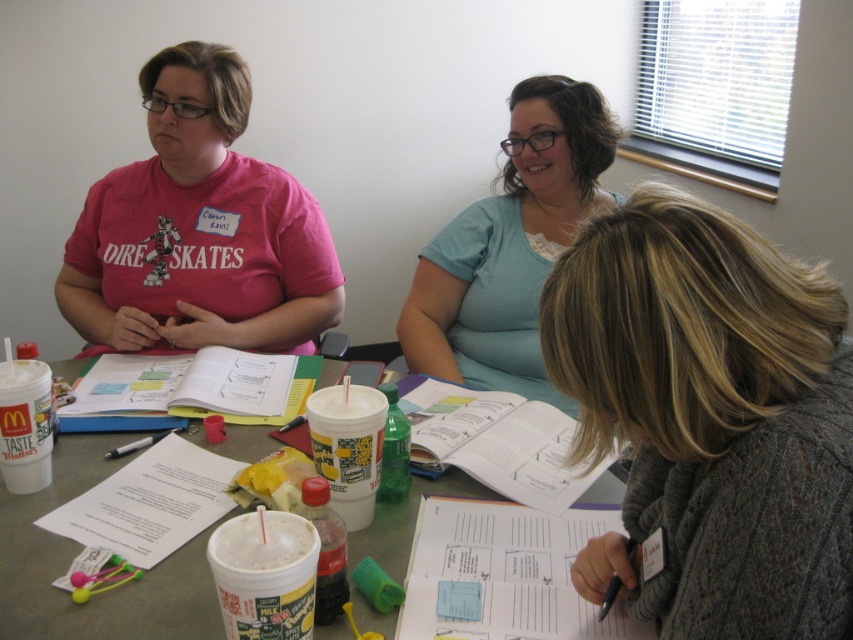
You are organizing a meeting and need to ensure there is enough space for important documents. Given the light blue fabric shirt at upper center and the white paper at center, which item takes up more space on the table?

The white paper at center takes up more space than the light blue fabric shirt at upper center because the light blue fabric shirt at upper center occupies less space than white paper at center.

What are the coordinates of the pink matte shirt at upper left?

The pink matte shirt at upper left is located at point (198, 228).

You are a tailor measuring shirts for alterations. You need to determine which shirt requires a longer hem. Based on the image, which shirt between the pink matte shirt at upper left and the light blue fabric shirt at upper center should you adjust more?

The light blue fabric shirt at upper center requires a longer hem since it has a greater height compared to the pink matte shirt at upper left.